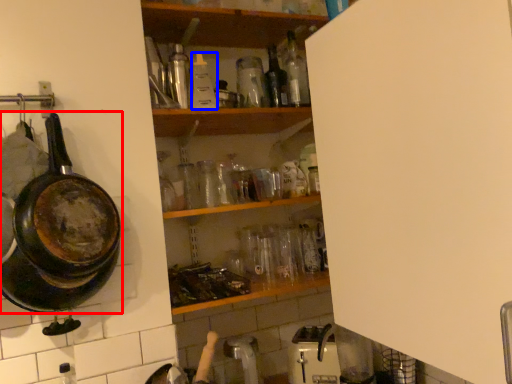
Question: Which object is closer to the camera taking this photo, frying pan (highlighted by a red box) or bottle (highlighted by a blue box)?

Choices:
 (A) frying pan
 (B) bottle

Answer: (A)